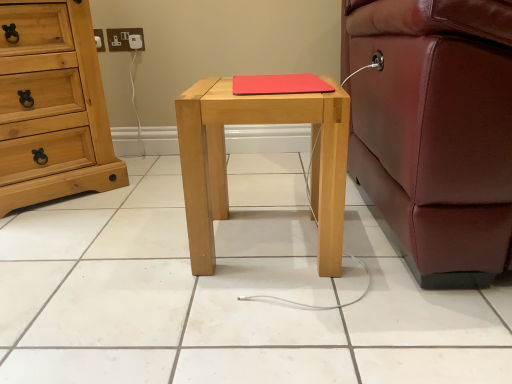
Question: From the image's perspective, is light wood/texture nightstand at center positioned above or below red matte mousepad at center?

Choices:
 (A) above
 (B) below

Answer: (B)

Question: In terms of height, does light wood/texture nightstand at center look taller or shorter compared to red matte mousepad at center?

Choices:
 (A) tall
 (B) short

Answer: (A)

Question: Which is farther from the red matte mousepad at center?

Choices:
 (A) light brown wooden chest of drawers at left
 (B) white plastic socket at upper left
 (C) light wood/texture nightstand at center

Answer: (B)

Question: Estimate the real-world distances between objects in this image. Which object is farther from the light wood/texture nightstand at center?

Choices:
 (A) white plastic socket at upper left
 (B) red matte mousepad at center
 (C) light brown wooden chest of drawers at left

Answer: (A)